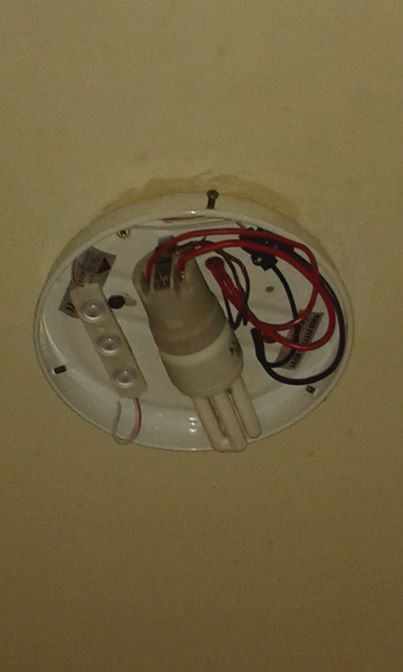
Where is `light bulb`? The width and height of the screenshot is (403, 672). light bulb is located at coordinates (230, 413).